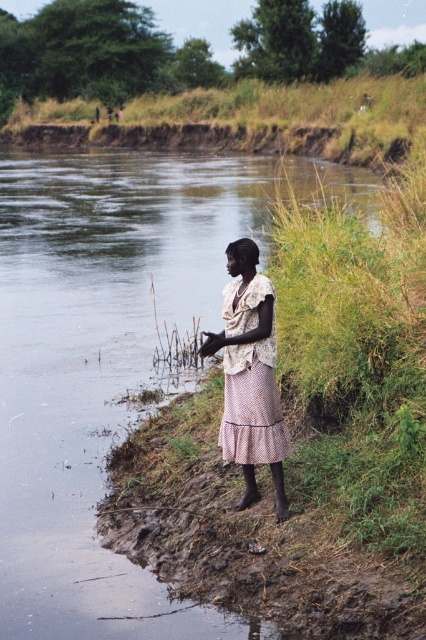
Question: Which point is closer to the camera taking this photo?

Choices:
 (A) (241, 394)
 (B) (209, 332)
 (C) (207, 124)
 (D) (66, 515)

Answer: (B)

Question: Which object is positioned closest to the pink dotted fabric dress at center?

Choices:
 (A) greenish water at river left
 (B) light beige lace blouse at center

Answer: (B)

Question: Which point is farther to the camera?

Choices:
 (A) brown dirt at upper center
 (B) light beige lace blouse at center

Answer: (A)

Question: From the image, what is the correct spatial relationship of greenish water at river left in relation to brown dirt at upper center?

Choices:
 (A) right
 (B) left

Answer: (A)

Question: Can you confirm if greenish water at river left is positioned to the right of pink dotted fabric dress at center?

Choices:
 (A) no
 (B) yes

Answer: (A)

Question: Is greenish water at river left positioned before brown dirt at upper center?

Choices:
 (A) yes
 (B) no

Answer: (A)